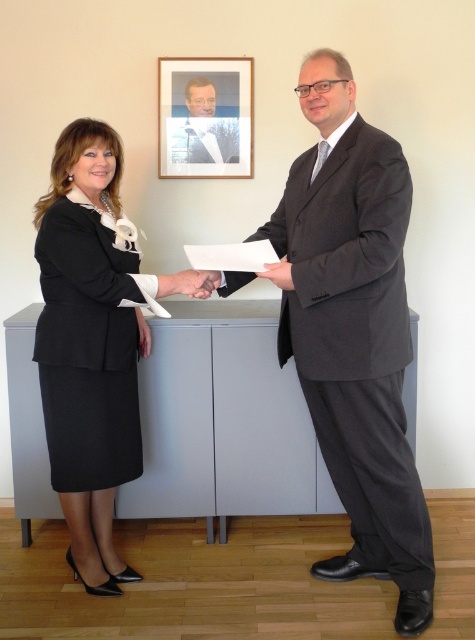
Does matte black suit at left appear on the right side of wooden picture frame at upper center?

No, matte black suit at left is not to the right of wooden picture frame at upper center.

Where is `matte black suit at left`? This screenshot has height=640, width=475. matte black suit at left is located at coordinates (93, 342).

This screenshot has width=475, height=640. In order to click on matte black suit at left in this screenshot , I will do `click(93, 342)`.

Locate an element on the screen. Image resolution: width=475 pixels, height=640 pixels. matte black suit at left is located at coordinates (93, 342).

Who is positioned more to the right, wooden picture frame at upper center or matte black suit at center?

wooden picture frame at upper center

Where is `wooden picture frame at upper center`? This screenshot has width=475, height=640. wooden picture frame at upper center is located at coordinates (205, 116).

Which is behind, point (190, 134) or point (195, 93)?

Point (190, 134)

Image resolution: width=475 pixels, height=640 pixels. In order to click on wooden picture frame at upper center in this screenshot , I will do `click(205, 116)`.

Does dark gray suit at right have a lesser height compared to wooden picture frame at upper center?

No.

The image size is (475, 640). I want to click on dark gray suit at right, so click(355, 339).

This screenshot has height=640, width=475. Describe the element at coordinates (355, 339) in the screenshot. I see `dark gray suit at right` at that location.

Identify the location of dark gray suit at right. This screenshot has height=640, width=475. (355, 339).